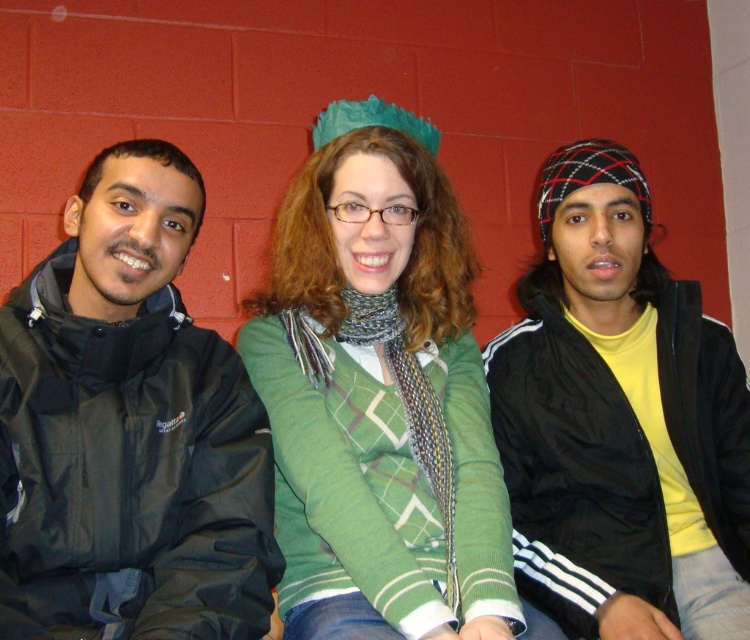
You are a photographer trying to capture a photo of the black matte jacket at right without the green knitted sweater at center blocking it. Based on their positions, is this possible?

The green knitted sweater at center is positioned over the black matte jacket at right, so it is blocking the view. To capture the black matte jacket at right without obstruction, you would need to adjust the angle or have the person move so the green knitted sweater at center is no longer in front.

You are a photographer trying to capture a closeup shot of the person on the right. You notice two points in the scene labeled as point [123,584] and point [558,374]. Which point should you focus on to ensure the person on the right is in sharp focus?

A: You should focus on point [123,584] because it is closer to the camera than point [558,374], which will keep the person on the right in focus.